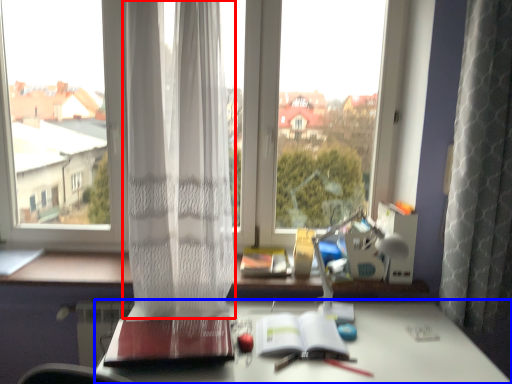
Question: Which point is further to the camera, curtain (highlighted by a red box) or desk (highlighted by a blue box)?

Choices:
 (A) curtain
 (B) desk

Answer: (A)